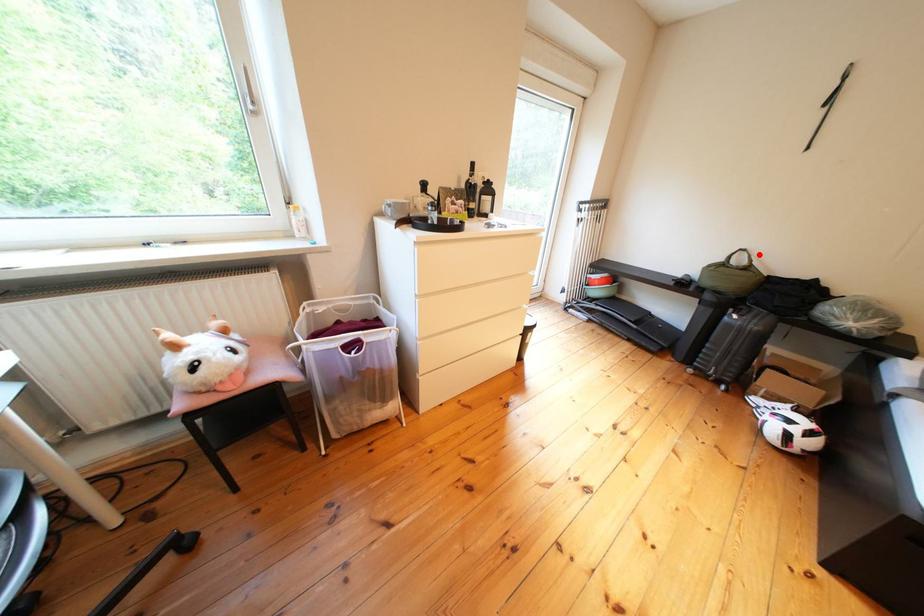
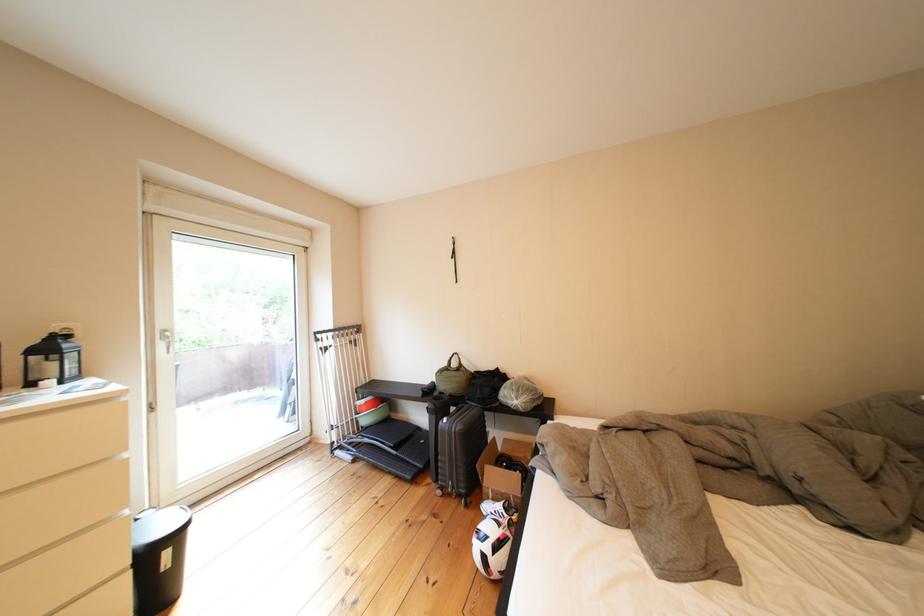
The point at the highlighted location is marked in the first image. Where is the corresponding point in the second image?

(469, 358)